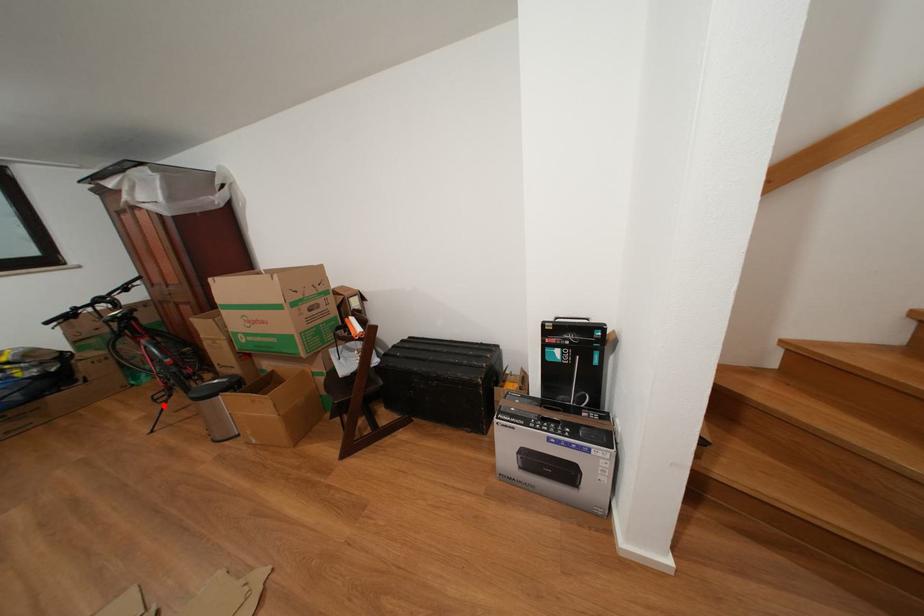
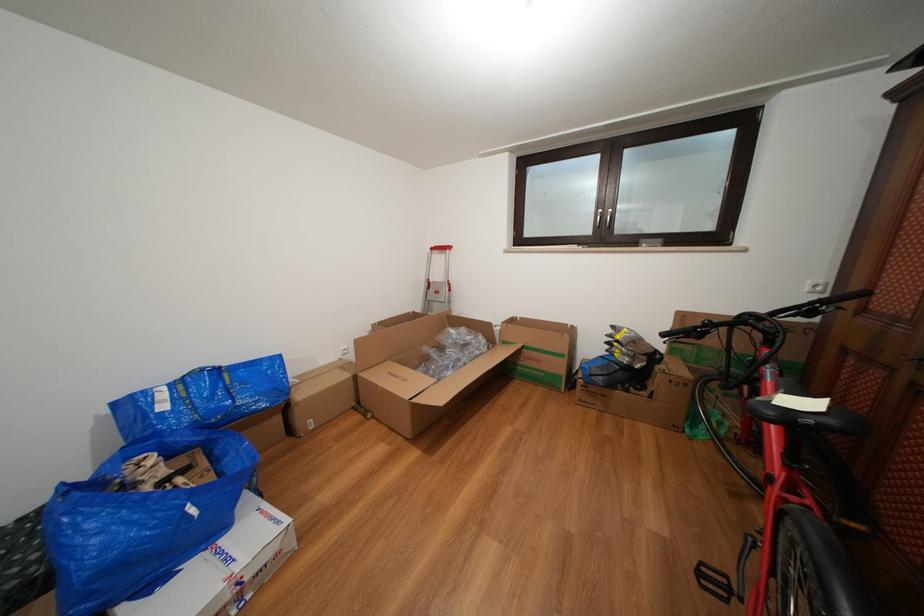
The point at the highlighted location is marked in the first image. Where is the corresponding point in the second image?

(708, 578)